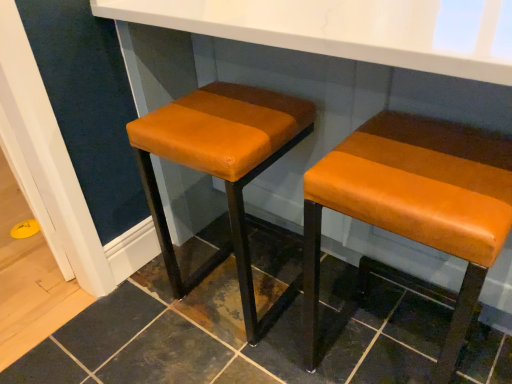
You are a GUI agent. You are given a task and a screenshot of the screen. Output one action in this format:
    pyautogui.click(x=<x>, y=<y>)
    Task: Click on the free spot below orange leather stool at center, the 2th stool from the right (from a real-world perspective)
    The height and width of the screenshot is (384, 512).
    Given the screenshot: What is the action you would take?
    pyautogui.click(x=224, y=312)